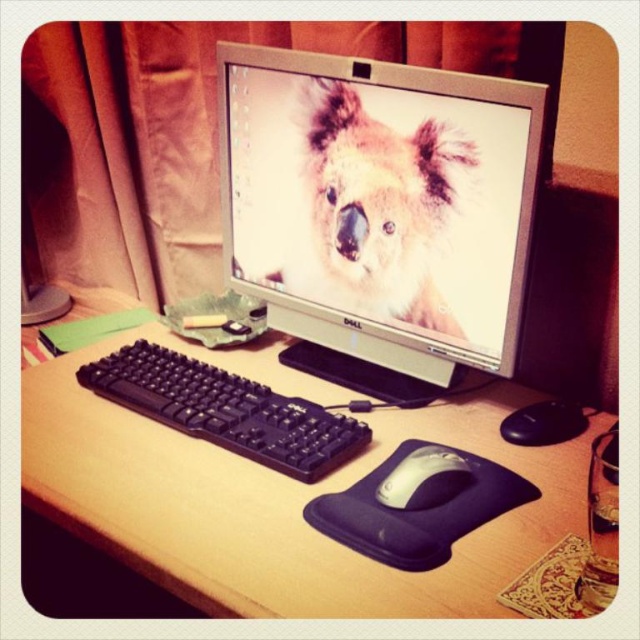
Does fluffy fur koala at center have a smaller size compared to white matte mouse at center?

No, fluffy fur koala at center is not smaller than white matte mouse at center.

Is fluffy fur koala at center thinner than white matte mouse at center?

No.

Is point (432, 124) less distant than point (394, 474)?

That is False.

Image resolution: width=640 pixels, height=640 pixels. What are the coordinates of `fluffy fur koala at center` in the screenshot? It's located at (371, 209).

Is point (502, 209) closer to viewer compared to point (445, 488)?

That is False.

Between satin silver monitor at center and white matte mouse at center, which one is positioned higher?

satin silver monitor at center is higher up.

Is point (452, 163) in front of point (436, 490)?

No, (452, 163) is behind (436, 490).

Identify the location of satin silver monitor at center. pyautogui.click(x=380, y=204).

Can you confirm if brown wood computer desk at center is positioned below white matte mouse at center?

Actually, brown wood computer desk at center is above white matte mouse at center.

Is point (236, 461) closer to camera compared to point (428, 449)?

No, (236, 461) is behind (428, 449).

Which is in front, point (230, 513) or point (396, 472)?

Positioned in front is point (230, 513).

Where is `brown wood computer desk at center`? This screenshot has width=640, height=640. brown wood computer desk at center is located at coordinates (278, 496).